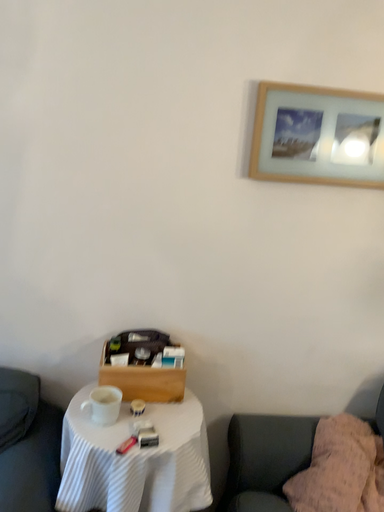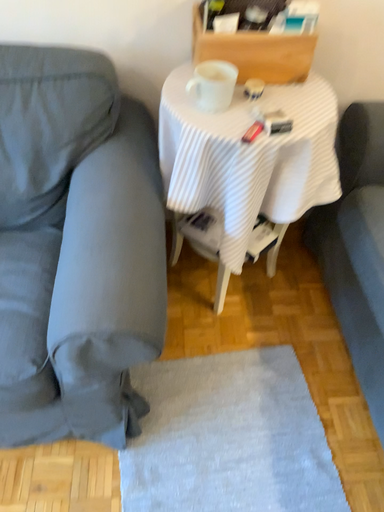
Question: How did the camera likely rotate when shooting the video?

Choices:
 (A) rotated downward
 (B) rotated upward

Answer: (A)